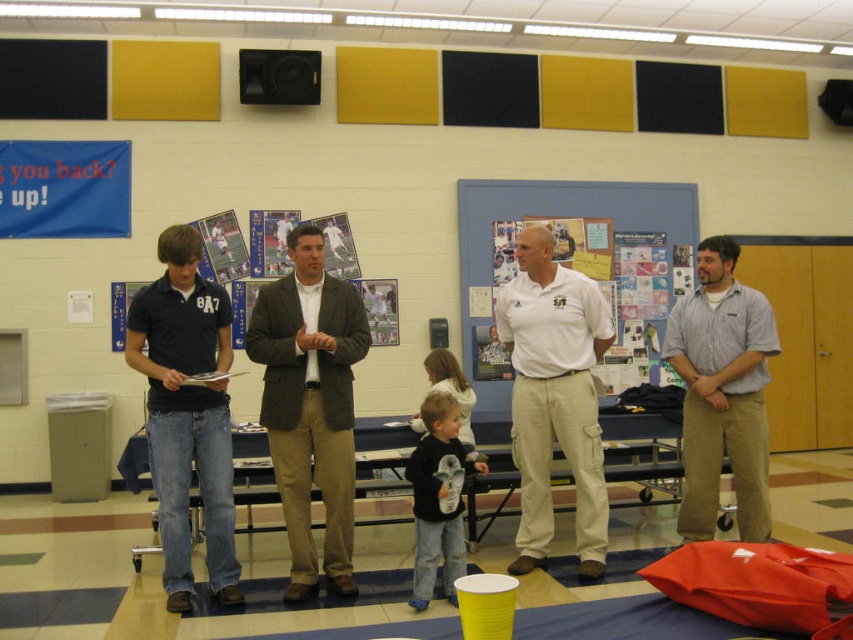
You are standing in the gymnasium and need to locate the brown textured blazer at center. According to the coordinates provided, where would you find it?

The brown textured blazer at center is located at coordinates point (310, 404).

You are a photographer standing in the gymnasium. You need to take a photo of the white cotton shirt at center and the blue matte bulletin board at center. Which object should be positioned closer to the camera to ensure both are in focus?

The white cotton shirt at center has a lesser height compared to blue matte bulletin board at center, so you should position the white cotton shirt at center closer to the camera to ensure both are in focus.

Based on the coordinates provided, what object is located at point (310, 404) in the scene?

The point (310, 404) corresponds to the brown textured blazer at center.